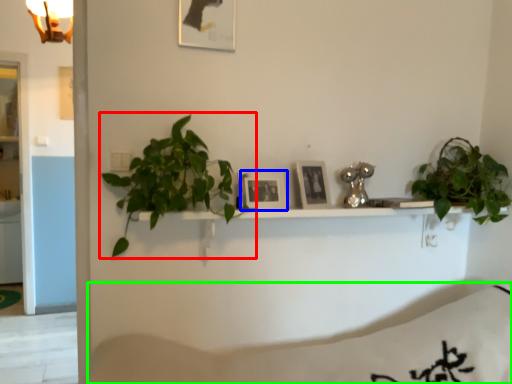
Question: Which object is the farthest from houseplant (highlighted by a red box)? Choose among these: picture frame (highlighted by a blue box) or bedding (highlighted by a green box).

Choices:
 (A) picture frame
 (B) bedding

Answer: (B)